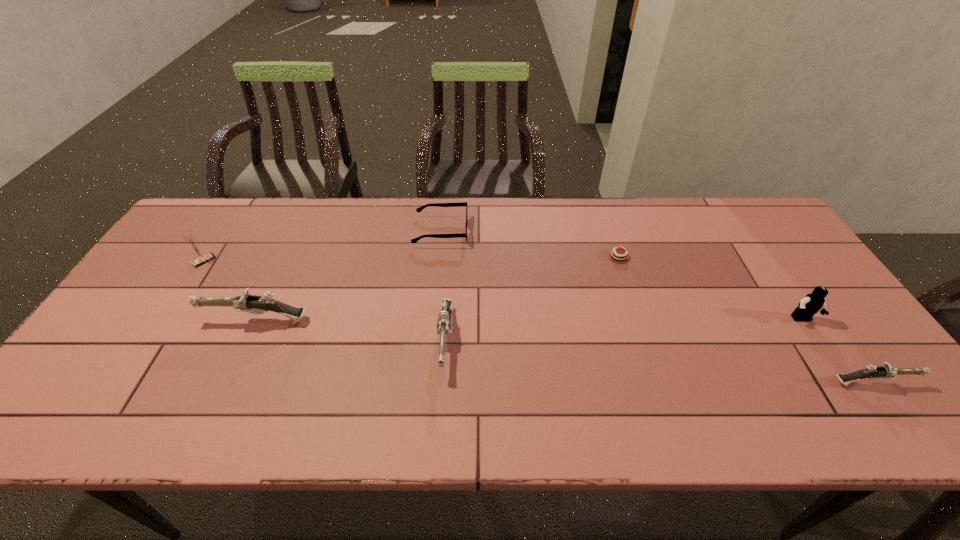
At what (x,y) coordinates should I click in order to perform the action: click on the shortest object. Please return your answer as a coordinate pair (x, y). The image size is (960, 540). Looking at the image, I should click on (617, 256).

This screenshot has width=960, height=540. I want to click on blank area located 0.060m aimed along the barrel of the sixth object from right to left, so click(181, 321).

Locate an element on the screen. Image resolution: width=960 pixels, height=540 pixels. free space located 0.140m aimed along the barrel of the sixth object from right to left is located at coordinates (151, 321).

Image resolution: width=960 pixels, height=540 pixels. Identify the location of free space located 0.150m aimed along the barrel of the sixth object from right to left. (147, 321).

Find the location of `free space located 0.320m on the right of the leftmost object`. free space located 0.320m on the right of the leftmost object is located at coordinates (323, 261).

The height and width of the screenshot is (540, 960). What are the coordinates of `blank space located on the arms of the second shortest object` in the screenshot? It's located at tap(559, 231).

Where is `vacant space located 0.160m on the front-facing side of the Lego`? Image resolution: width=960 pixels, height=540 pixels. vacant space located 0.160m on the front-facing side of the Lego is located at coordinates (842, 380).

You are a GUI agent. You are given a task and a screenshot of the screen. Output one action in this format:
    pyautogui.click(x=<x>, y=<y>)
    Task: Click on the free spot located on the right of the shortest object
    This screenshot has height=540, width=960.
    Given the screenshot: What is the action you would take?
    pyautogui.click(x=684, y=257)

Find the location of `spectacles that is positioned at the far edge`. spectacles that is positioned at the far edge is located at coordinates (419, 209).

This screenshot has height=540, width=960. In order to click on chocolate cake that is at the far edge in this screenshot , I will do `click(617, 256)`.